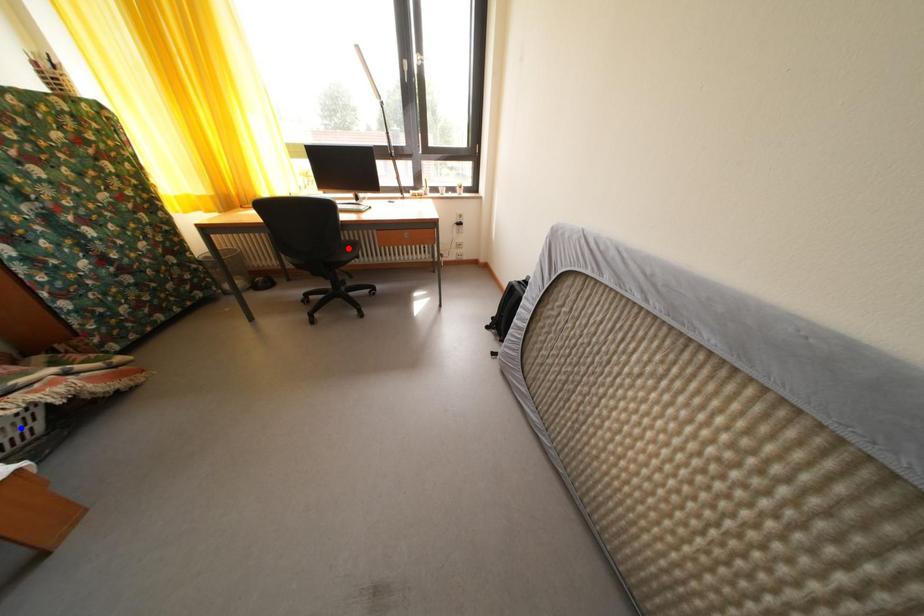
Question: Two points are marked on the image. Which point is closer to the camera?

Choices:
 (A) Blue point is closer.
 (B) Red point is closer.

Answer: (A)